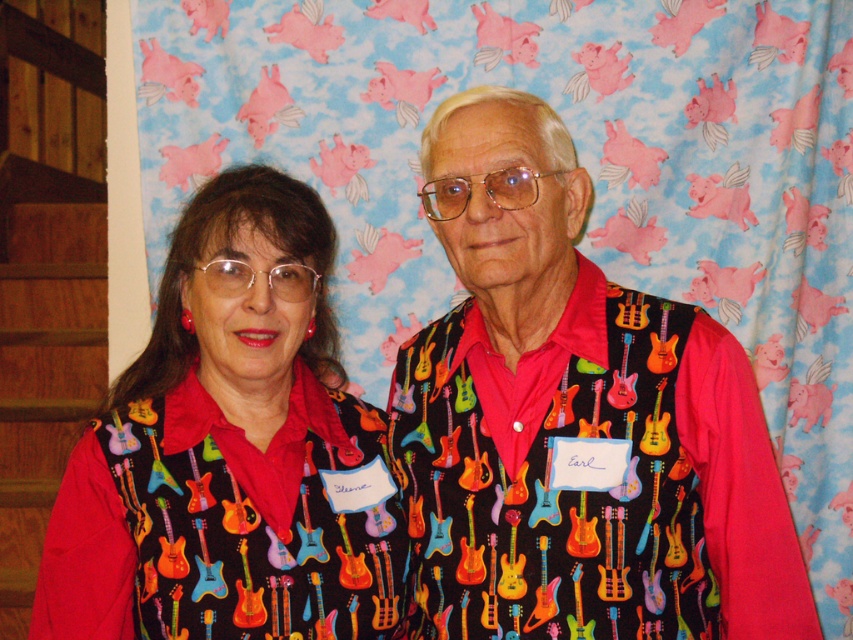
Question: Where is multicolored fabric guitar vest at center located in relation to matte black shirt with guitar pattern at center in the image?

Choices:
 (A) right
 (B) left

Answer: (A)

Question: Which object appears closest to the camera in this image?

Choices:
 (A) matte black shirt with guitar pattern at center
 (B) multicolored fabric guitar vest at center

Answer: (B)

Question: Observing the image, what is the correct spatial positioning of multicolored fabric guitar vest at center in reference to matte black shirt with guitar pattern at center?

Choices:
 (A) below
 (B) above

Answer: (B)

Question: Can you confirm if multicolored fabric guitar vest at center is positioned to the right of matte black shirt with guitar pattern at center?

Choices:
 (A) no
 (B) yes

Answer: (B)

Question: Which of the following is the farthest from the observer?

Choices:
 (A) (291, 378)
 (B) (524, 384)

Answer: (A)